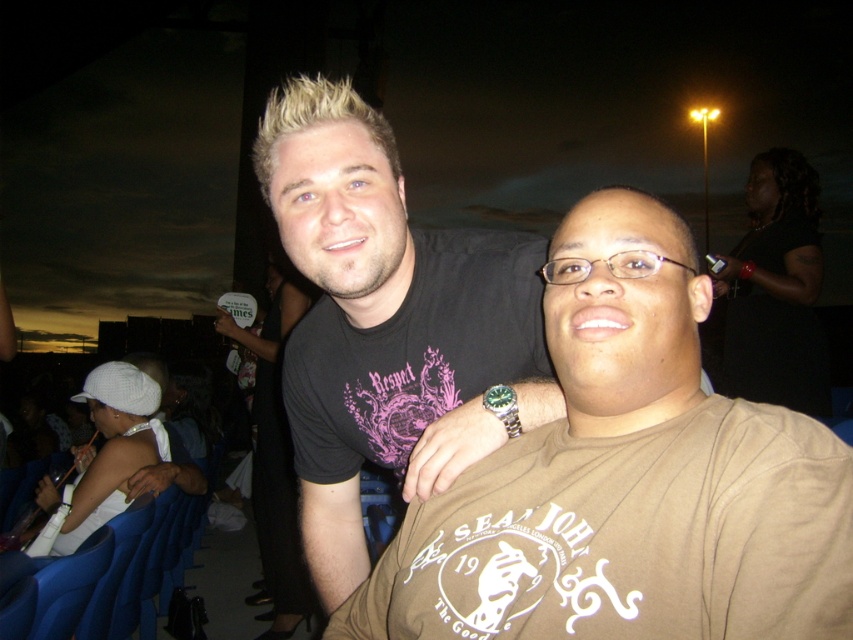
Question: Is brown cotton t-shirt at center to the right of black matte t-shirt at center from the viewer's perspective?

Choices:
 (A) yes
 (B) no

Answer: (A)

Question: Among these points, which one is nearest to the camera?

Choices:
 (A) (822, 477)
 (B) (283, 403)

Answer: (A)

Question: Which of the following is the closest to the observer?

Choices:
 (A) (508, 384)
 (B) (578, 344)

Answer: (B)

Question: Is brown cotton t-shirt at center to the left of black matte t-shirt at center from the viewer's perspective?

Choices:
 (A) no
 (B) yes

Answer: (A)

Question: Is brown cotton t-shirt at center bigger than black matte t-shirt at center?

Choices:
 (A) no
 (B) yes

Answer: (A)